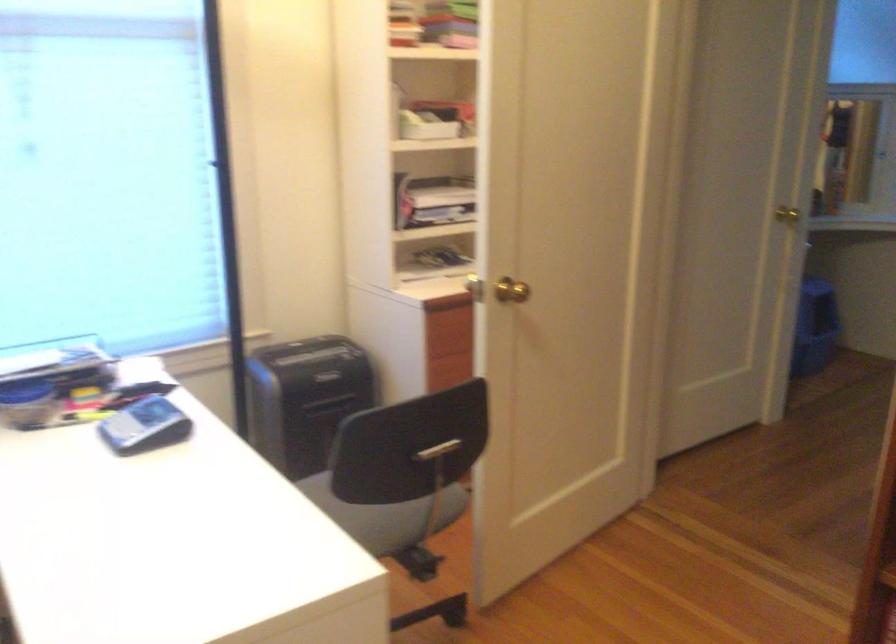
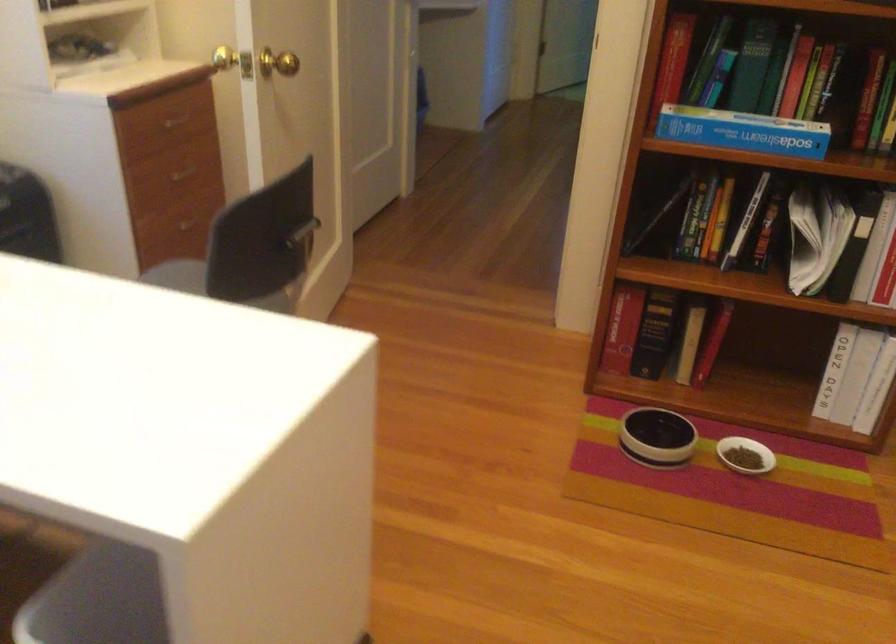
In the second image, find the point that corresponds to pixel 563 442 in the first image.

(304, 232)